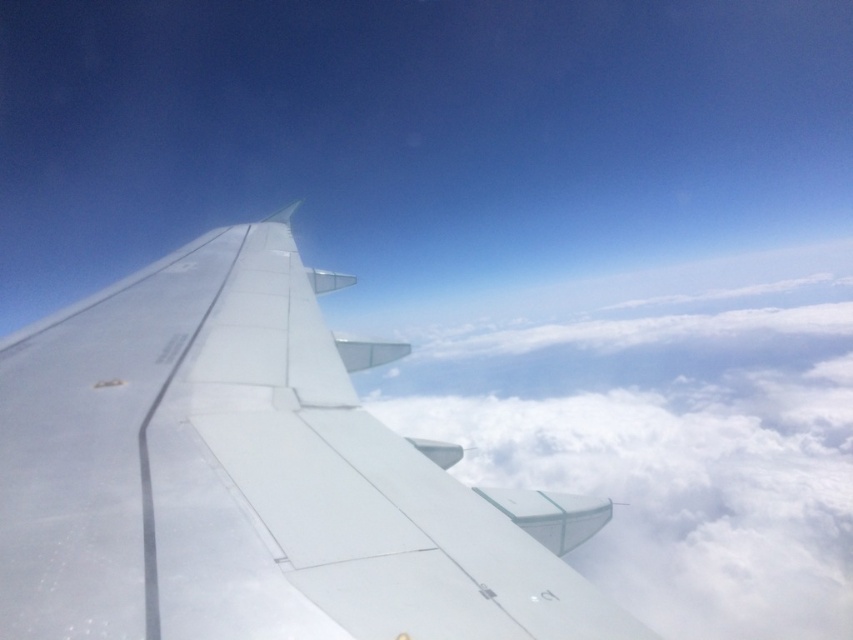
You are a passenger on the airplane and you look out the window. You see the white matte airplane wing at upper left and the white fluffy cloud at center. Which object is closer to the left edge of the window?

The white matte airplane wing at upper left is closer to the left edge of the window because it is positioned on the left side of the white fluffy cloud at center.

You are a passenger sitting in the airplane and looking out the window. You notice two points marked on the wing at coordinates point (74, 445) and point (409, 396). Which point is physically closer to your seat?

Point (74, 445) is closer to the camera than point (409, 396), so the point (74, 445) is physically closer to your seat.